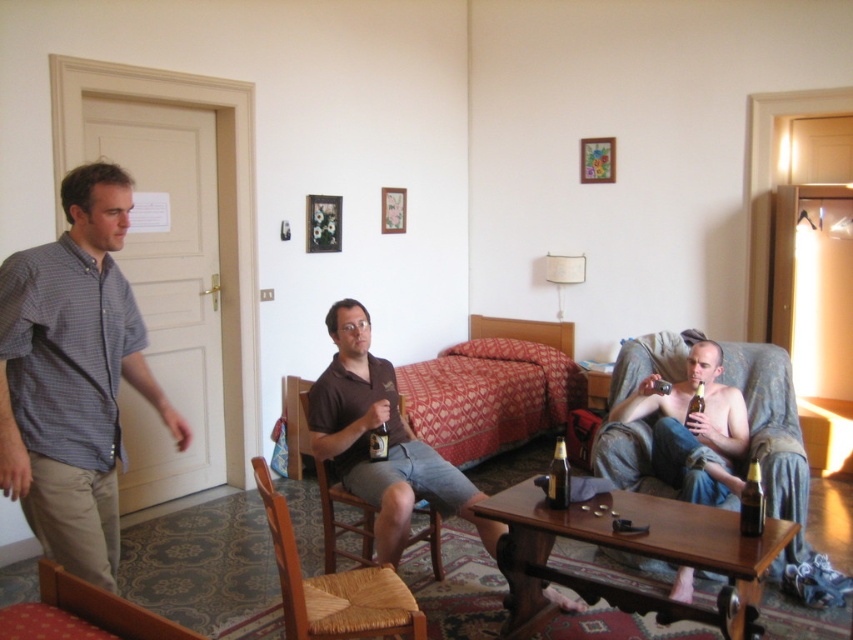
Question: Which object is closer to the camera taking this photo?

Choices:
 (A) denim fabric couch at lower right
 (B) matte glass beer at center
 (C) wooden woven chair at lower left

Answer: (C)

Question: In this image, where is brown cotton shirt at center located relative to wooden woven chair at lower left?

Choices:
 (A) right
 (B) left

Answer: (A)

Question: Is checkered fabric shirt at left bigger than wooden woven chair at lower left?

Choices:
 (A) no
 (B) yes

Answer: (B)

Question: Which point is closer to the camera?

Choices:
 (A) (386, 445)
 (B) (430, 524)
 (C) (560, 504)
 (D) (117, 627)

Answer: (D)

Question: Is denim fabric couch at lower right in front of matte glass beer at center?

Choices:
 (A) no
 (B) yes

Answer: (A)

Question: Considering the real-world distances, which object is closest to the matte glass beer at center?

Choices:
 (A) checkered fabric shirt at left
 (B) brown glass bottle at right

Answer: (A)